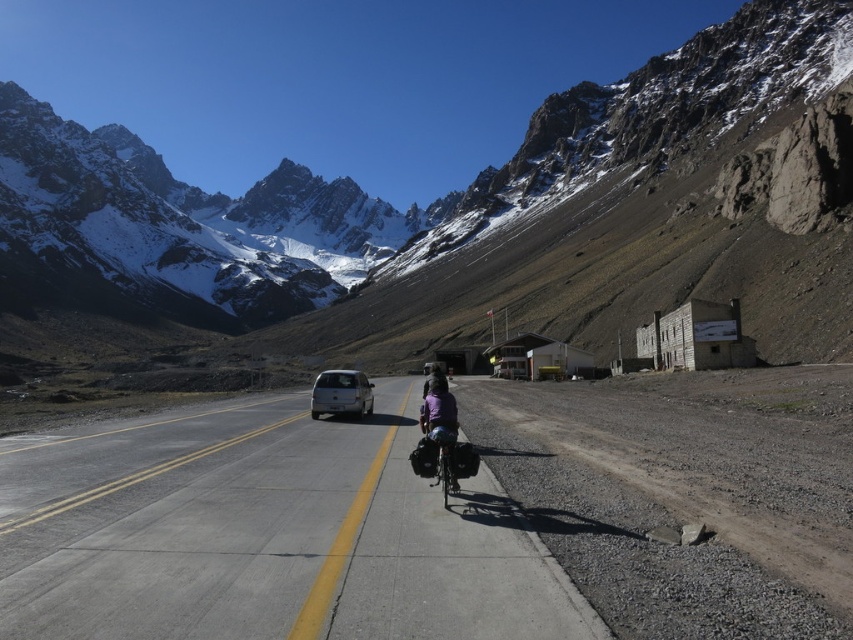
Question: Is snowy rocky mountain range at upper center wider than metallic silver bicycle at center?

Choices:
 (A) yes
 (B) no

Answer: (A)

Question: Which object is the closest to the snowy rocky mountain range at upper center?

Choices:
 (A) metallic silver bicycle at center
 (B) silver metallic van at center
 (C) asphalt road at center

Answer: (C)

Question: Which object is positioned closest to the metallic silver bicycle at center?

Choices:
 (A) snowy rocky mountain range at upper center
 (B) asphalt road at center

Answer: (B)

Question: Which of these objects is positioned farthest from the metallic silver bicycle at center?

Choices:
 (A) silver metallic van at center
 (B) snowy rocky mountain range at upper center
 (C) asphalt road at center

Answer: (B)

Question: Does snowy rocky mountain range at upper center have a lesser width compared to metallic silver bicycle at center?

Choices:
 (A) no
 (B) yes

Answer: (A)

Question: Is the position of asphalt road at center more distant than that of metallic silver bicycle at center?

Choices:
 (A) yes
 (B) no

Answer: (B)